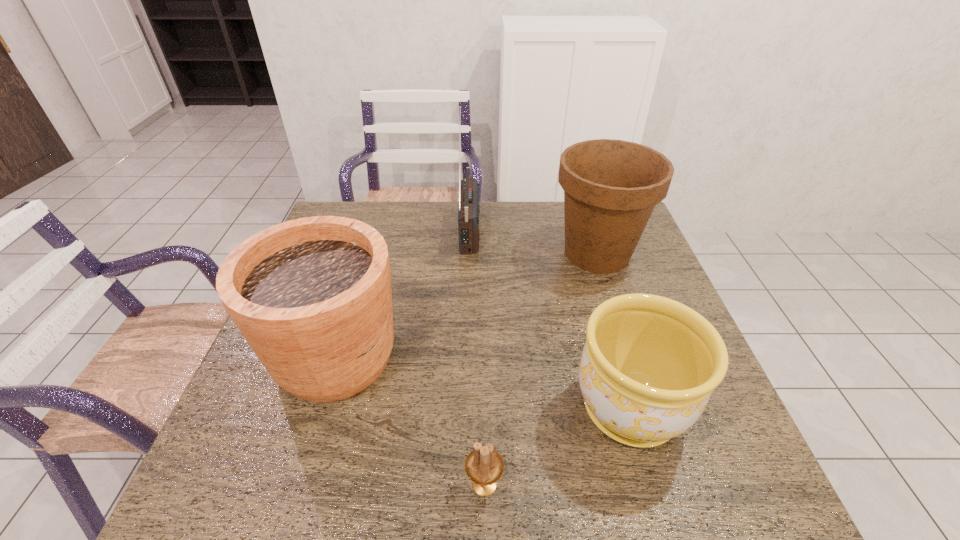
The width and height of the screenshot is (960, 540). In order to click on radio receiver in this screenshot , I will do `click(469, 208)`.

You are a GUI agent. You are given a task and a screenshot of the screen. Output one action in this format:
    pyautogui.click(x=<x>, y=<y>)
    Task: Click on the farthest flowerpot
    Image resolution: width=960 pixels, height=540 pixels.
    Given the screenshot: What is the action you would take?
    pyautogui.click(x=611, y=187)

In order to click on the leftmost object in this screenshot , I will do point(312,296).

This screenshot has width=960, height=540. What are the coordinates of `the second shortest object` in the screenshot? It's located at (649, 365).

Locate an element on the screen. the nearest object is located at coordinates (484, 466).

What are the coordinates of `the shortest object` in the screenshot? It's located at (484, 466).

Locate an element on the screen. free region located on the front-facing side of the radio receiver is located at coordinates (571, 229).

Image resolution: width=960 pixels, height=540 pixels. Find the location of `vacant region located on the back of the farthest flowerpot`. vacant region located on the back of the farthest flowerpot is located at coordinates tap(581, 204).

Locate an element on the screen. This screenshot has width=960, height=540. free point located 0.110m on the right of the leftmost object is located at coordinates (449, 356).

You are a GUI agent. You are given a task and a screenshot of the screen. Output one action in this format:
    pyautogui.click(x=<x>, y=<y>)
    Task: Click on the vacant point located on the back of the shortest flowerpot
    Image resolution: width=960 pixels, height=540 pixels.
    Given the screenshot: What is the action you would take?
    pyautogui.click(x=590, y=274)